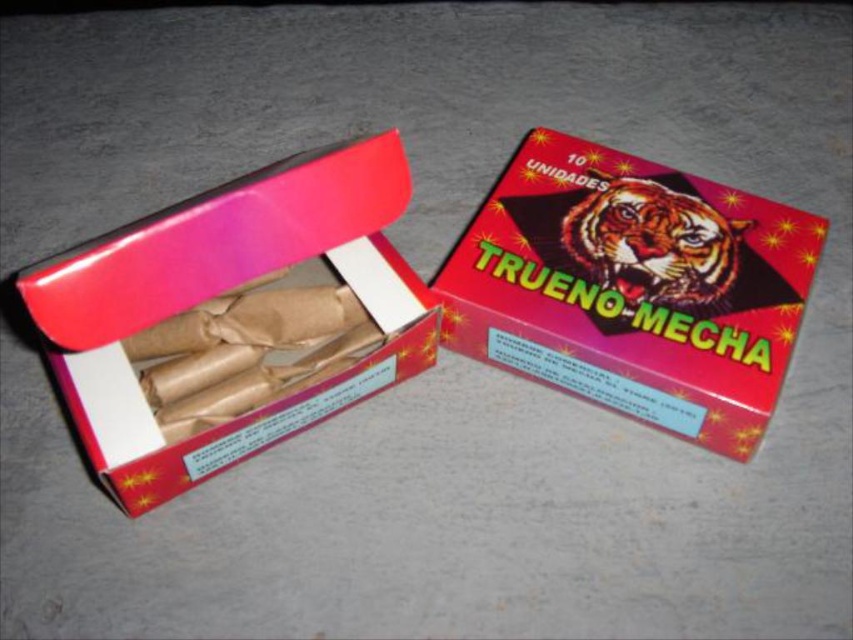
Question: Does matte cardboard box at left have a smaller size compared to shiny orange tiger at center?

Choices:
 (A) no
 (B) yes

Answer: (A)

Question: Is matte cardboard box at left smaller than shiny orange tiger at center?

Choices:
 (A) yes
 (B) no

Answer: (B)

Question: Which point is closer to the camera?

Choices:
 (A) shiny orange tiger at center
 (B) shiny red cardboard box at center
 (C) matte cardboard box at left

Answer: (C)

Question: Is shiny red cardboard box at center positioned at the back of shiny orange tiger at center?

Choices:
 (A) yes
 (B) no

Answer: (B)

Question: Which of these objects is positioned farthest from the matte cardboard box at left?

Choices:
 (A) shiny orange tiger at center
 (B) shiny red cardboard box at center

Answer: (A)

Question: Which point is farther from the camera taking this photo?

Choices:
 (A) (570, 308)
 (B) (595, 179)

Answer: (B)